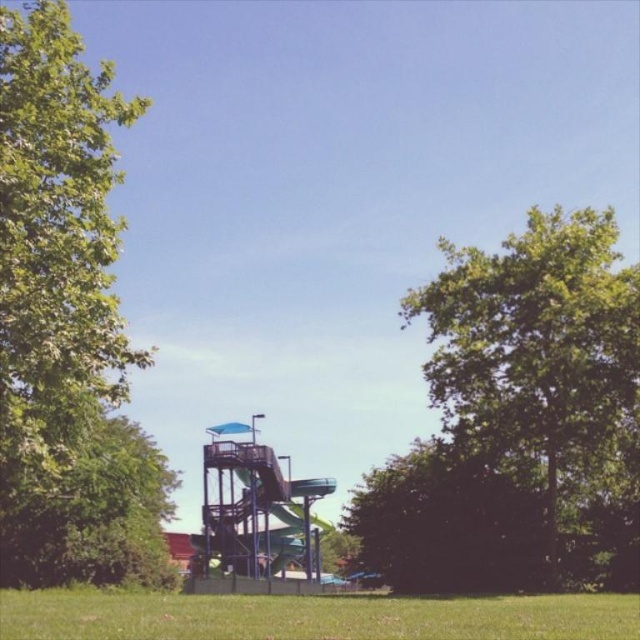
Question: From the image, what is the correct spatial relationship of green leafy tree at right in relation to metallic blue slide at center?

Choices:
 (A) right
 (B) left

Answer: (A)

Question: Which object is positioned closest to the green leafy tree at left?

Choices:
 (A) green leafy tree at right
 (B) green grass at lower center
 (C) metallic blue slide at center

Answer: (C)

Question: Which of the following is the farthest from the observer?

Choices:
 (A) (28, 604)
 (B) (634, 419)
 (C) (68, 216)
 (D) (253, 472)

Answer: (D)

Question: Is green leafy tree at left bigger than metallic blue slide at center?

Choices:
 (A) no
 (B) yes

Answer: (B)

Question: Which of the following is the closest to the observer?

Choices:
 (A) green leafy tree at right
 (B) green leafy tree at left
 (C) metallic blue slide at center
 (D) green grass at lower center

Answer: (D)

Question: Does green leafy tree at left lie in front of metallic blue slide at center?

Choices:
 (A) no
 (B) yes

Answer: (B)